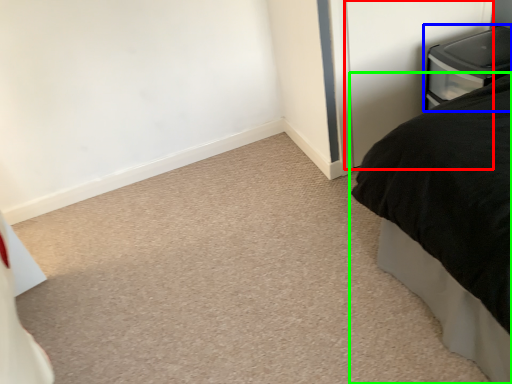
Question: Which object is positioned farthest from screen door (highlighted by a red box)? Select from furniture (highlighted by a blue box) and bed (highlighted by a green box).

Choices:
 (A) furniture
 (B) bed

Answer: (B)